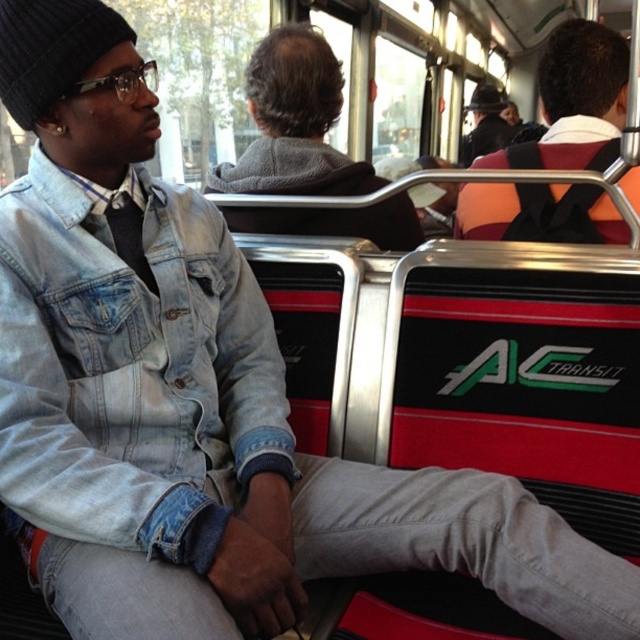
Question: Is black knit beanie at upper left wider than black knit hat at upper center?

Choices:
 (A) yes
 (B) no

Answer: (B)

Question: Which object appears farthest from the camera in this image?

Choices:
 (A) black knit beanie at upper left
 (B) dark brown hair at center
 (C) faded denim jacket at lower right

Answer: (B)

Question: Observing the image, what is the correct spatial positioning of dark brown hair at center in reference to orange fabric backpack at upper right?

Choices:
 (A) above
 (B) below

Answer: (B)

Question: Which of the following is the farthest from the observer?

Choices:
 (A) faded denim jacket at lower right
 (B) dark brown hair at center

Answer: (B)

Question: Among these objects, which one is nearest to the camera?

Choices:
 (A) orange fabric backpack at upper right
 (B) black knit beanie at upper left

Answer: (B)

Question: Is dark brown hair at center to the left of orange fabric backpack at upper right from the viewer's perspective?

Choices:
 (A) no
 (B) yes

Answer: (B)